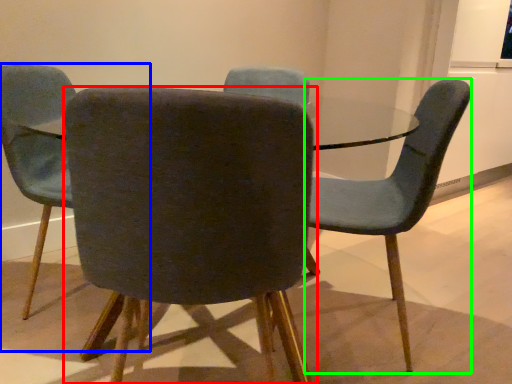
Question: Estimate the real-world distances between objects in this image. Which object is closer to chair (highlighted by a red box), chair (highlighted by a blue box) or chair (highlighted by a green box)?

Choices:
 (A) chair
 (B) chair

Answer: (B)